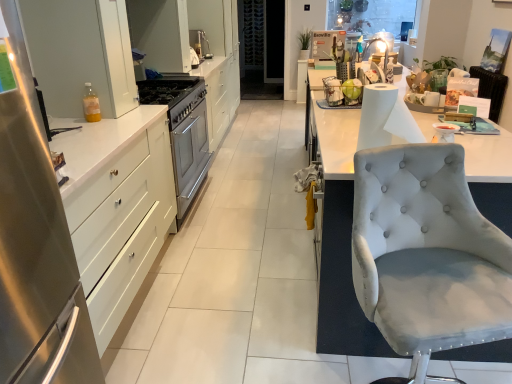
I want to click on vacant area located to the right-hand side of translucent plastic bottle at left, so click(125, 112).